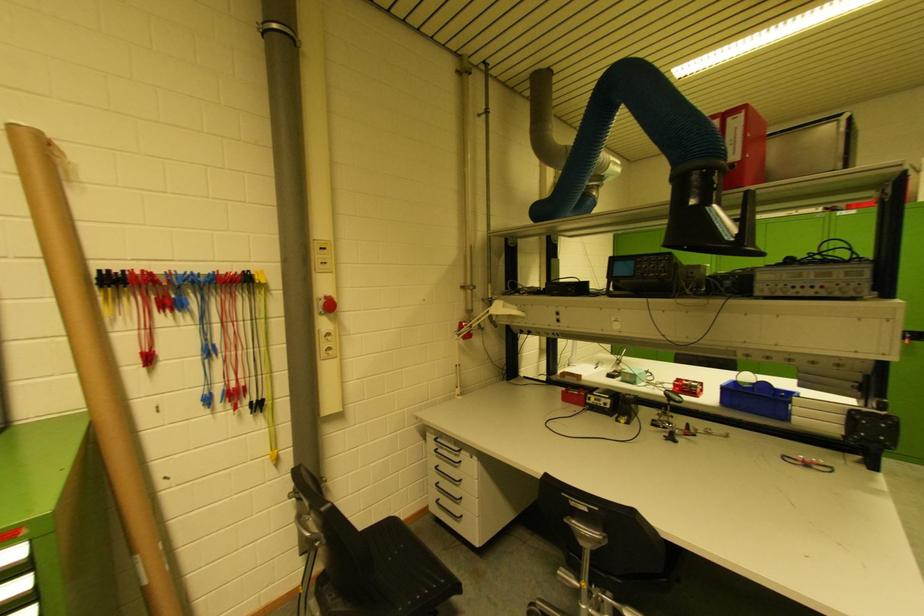
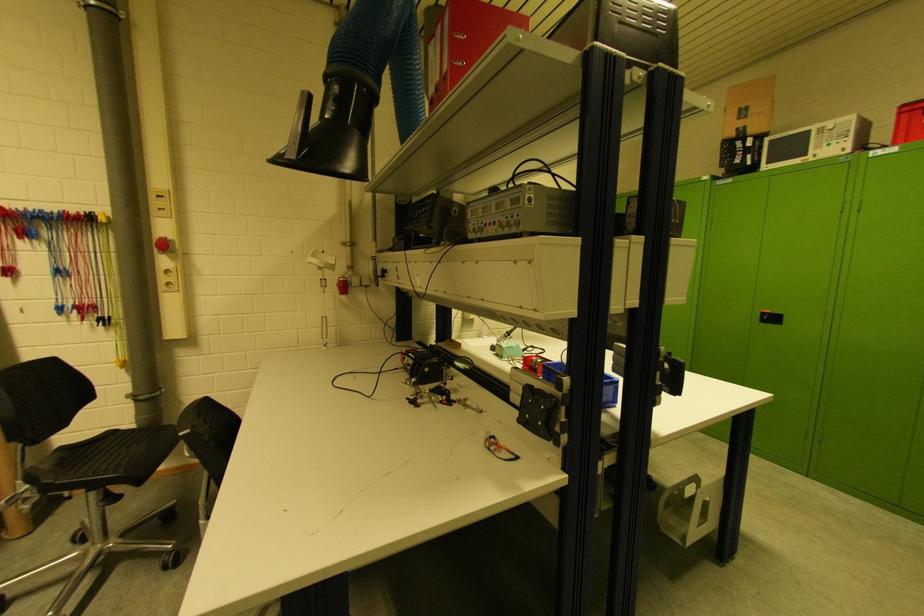
Question: The images are taken continuously from a first-person perspective. In which direction are you moving?

Choices:
 (A) Left
 (B) Right
 (C) Forward
 (D) Backward

Answer: (B)